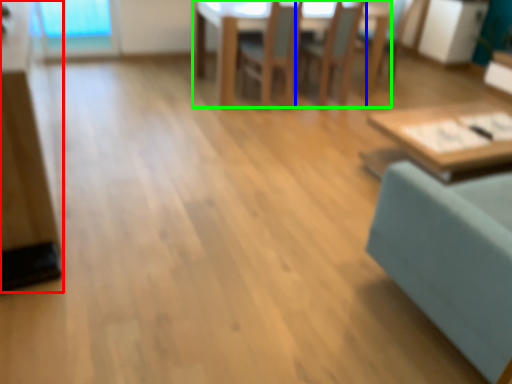
Question: Which object is the farthest from dresser (highlighted by a red box)? Choose among these: chair (highlighted by a blue box) or table (highlighted by a green box).

Choices:
 (A) chair
 (B) table

Answer: (A)